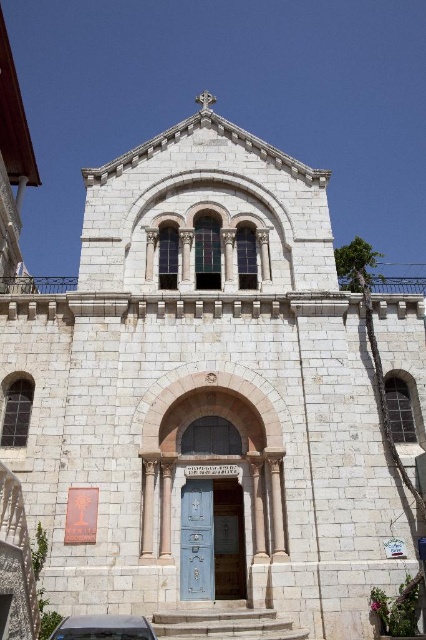
You are a visitor arriving at the church and see the blue painted wood door at center and the metallic silver car at lower center. Which object is closer to you?

The metallic silver car at lower center is behind the blue painted wood door at center, so the blue painted wood door at center is closer to you.

You are a visitor arriving at the church and see the blue painted wood door at center and the metallic silver car at lower center. Which object is positioned higher in the image?

The blue painted wood door at center is above the metallic silver car at lower center, so the blue painted wood door at center is positioned higher.